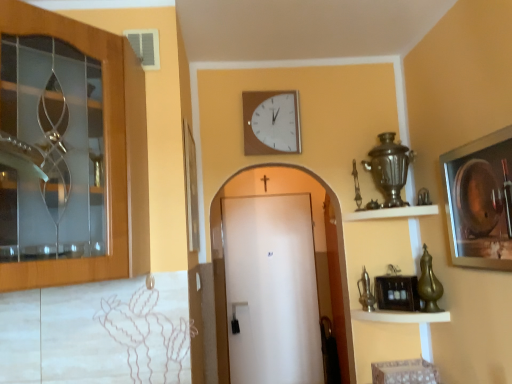
Question: Does white wooden clock at upper center have a larger size compared to white matte door at center, the 2th door from the front?

Choices:
 (A) yes
 (B) no

Answer: (B)

Question: From the image's perspective, is white wooden clock at upper center on top of white matte door at center, the first door in the bottom-to-top sequence?

Choices:
 (A) yes
 (B) no

Answer: (A)

Question: Is white wooden clock at upper center surrounding white matte door at center, the first door viewed from the back?

Choices:
 (A) no
 (B) yes

Answer: (A)

Question: Is the surface of white wooden clock at upper center in direct contact with white matte door at center, the first door in the bottom-to-top sequence?

Choices:
 (A) yes
 (B) no

Answer: (B)

Question: Does white wooden clock at upper center have a smaller size compared to white matte door at center, which is counted as the 2th door, starting from the top?

Choices:
 (A) no
 (B) yes

Answer: (B)

Question: Are white wooden clock at upper center and white matte door at center, which appears as the 2th door when viewed from the left, located far from each other?

Choices:
 (A) yes
 (B) no

Answer: (A)

Question: Is metallic silver picture frame at right oriented away from metallic brass shelf at lower right, which is the 2th shelf from top to bottom?

Choices:
 (A) yes
 (B) no

Answer: (B)

Question: Does metallic silver picture frame at right appear on the right side of metallic brass shelf at lower right, which is the 2th shelf from top to bottom?

Choices:
 (A) yes
 (B) no

Answer: (A)

Question: Is metallic silver picture frame at right further to the viewer compared to metallic brass shelf at lower right, arranged as the 1th shelf when ordered from the bottom?

Choices:
 (A) yes
 (B) no

Answer: (B)

Question: Is metallic brass shelf at lower right, which is the 2th shelf from top to bottom, a part of metallic silver picture frame at right?

Choices:
 (A) no
 (B) yes

Answer: (A)

Question: From a real-world perspective, is metallic silver picture frame at right on top of metallic brass shelf at lower right, arranged as the 1th shelf when ordered from the bottom?

Choices:
 (A) no
 (B) yes

Answer: (B)

Question: Is metallic silver picture frame at right aimed at metallic brass shelf at lower right, which is the 2th shelf from top to bottom?

Choices:
 (A) yes
 (B) no

Answer: (B)

Question: Does metallic brass shelf at lower right, which is the 2th shelf from top to bottom, have a lesser width compared to white matte door at center, the first door viewed from the back?

Choices:
 (A) no
 (B) yes

Answer: (A)